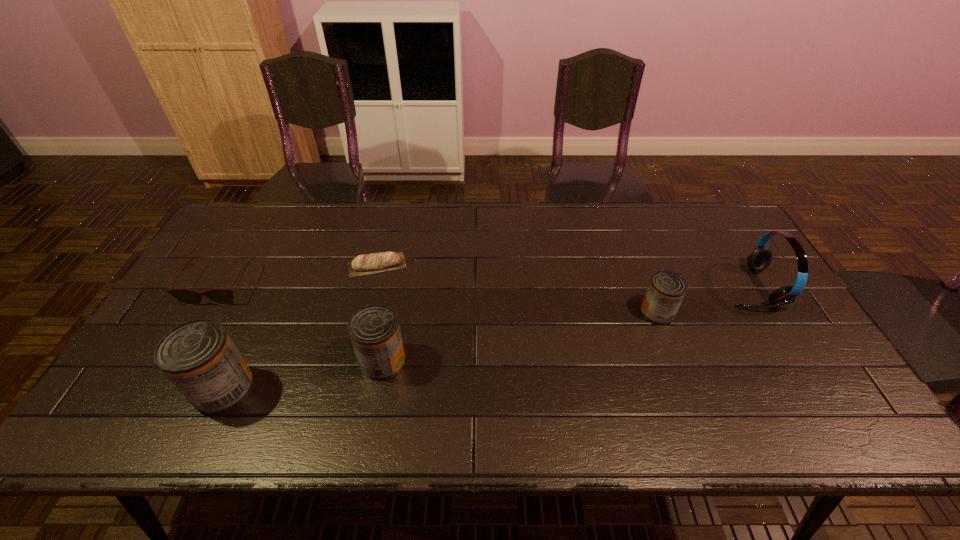
At what (x,y) coordinates should I click in order to perform the action: click on free space located on the front of the shortest can. Please return your answer as a coordinate pair (x, y). The image size is (960, 540). Looking at the image, I should click on (683, 381).

Where is `free space located 0.150m with the microphone attached to the side of the headset`? The height and width of the screenshot is (540, 960). free space located 0.150m with the microphone attached to the side of the headset is located at coordinates (673, 288).

This screenshot has height=540, width=960. I want to click on free space located 0.080m with the microphone attached to the side of the headset, so click(697, 288).

At what (x,y) coordinates should I click in order to perform the action: click on vacant space located 0.090m with the microphone attached to the side of the headset. Please return your answer as a coordinate pair (x, y). The width and height of the screenshot is (960, 540). Looking at the image, I should click on (694, 288).

Image resolution: width=960 pixels, height=540 pixels. In order to click on vacant area located on the front of the shortest object in this screenshot , I will do `click(365, 317)`.

The height and width of the screenshot is (540, 960). Find the location of `free space located at the front view of the fifth tallest object`. free space located at the front view of the fifth tallest object is located at coordinates (183, 349).

This screenshot has height=540, width=960. What are the coordinates of `object that is at the left edge` in the screenshot? It's located at (186, 296).

What are the coordinates of `object that is positioned at the right edge` in the screenshot? It's located at (760, 257).

In the image, there is a desktop. Where is `vacant space at the far edge`? The height and width of the screenshot is (540, 960). vacant space at the far edge is located at coordinates (415, 235).

In the image, there is a desktop. At what (x,y) coordinates should I click in order to perform the action: click on blank space at the near edge. Please return your answer as a coordinate pair (x, y). Image resolution: width=960 pixels, height=540 pixels. Looking at the image, I should click on (346, 394).